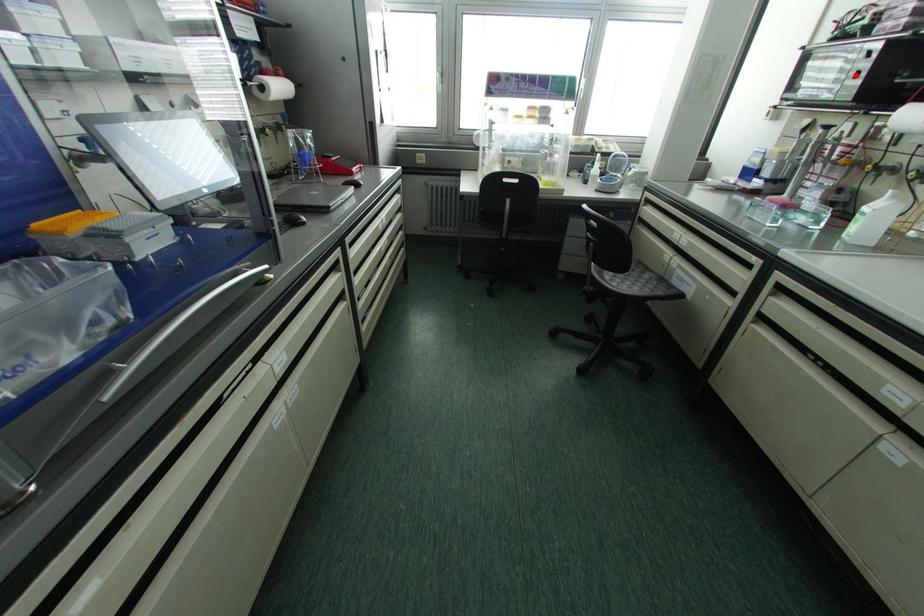
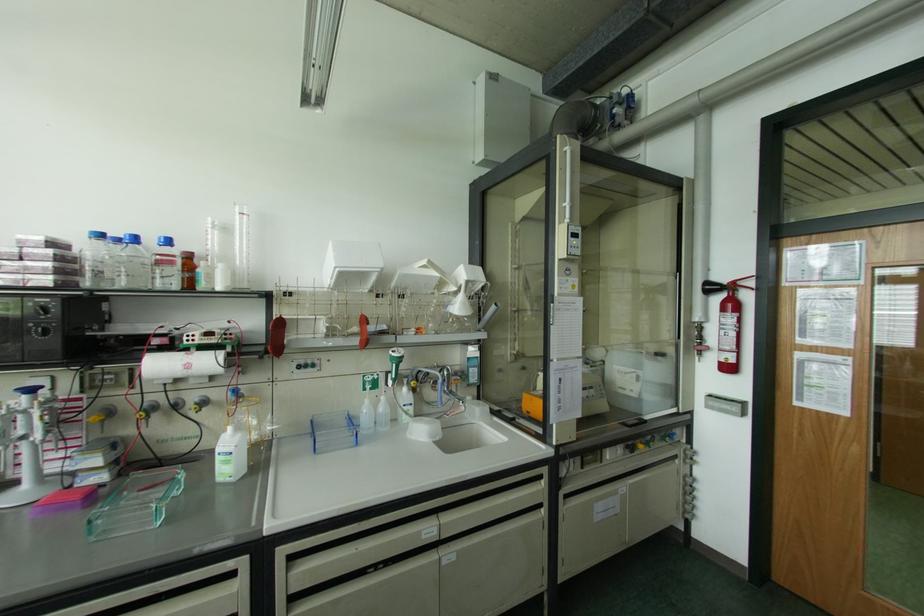
Question: A red point is marked in image1. In image2, is the corresponding 3D point closer to the camera or farther? Reply with the corresponding letter.

Choices:
 (A) The corresponding 3D point is closer.
 (B) The corresponding 3D point is farther.

Answer: (A)